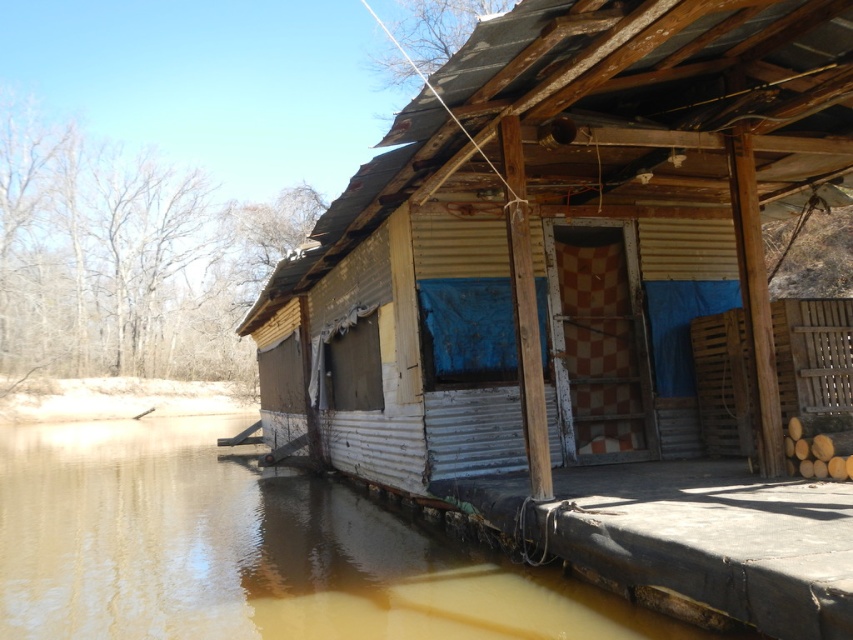
Question: Is yellow corrugated metal hut at center closer to camera compared to brown murky water at lower left?

Choices:
 (A) yes
 (B) no

Answer: (A)

Question: Which point is closer to the camera?

Choices:
 (A) yellow corrugated metal hut at center
 (B) brown murky water at lower left

Answer: (A)

Question: Is yellow corrugated metal hut at center thinner than brown murky water at lower left?

Choices:
 (A) yes
 (B) no

Answer: (A)

Question: Is yellow corrugated metal hut at center positioned at the back of brown murky water at lower left?

Choices:
 (A) no
 (B) yes

Answer: (A)